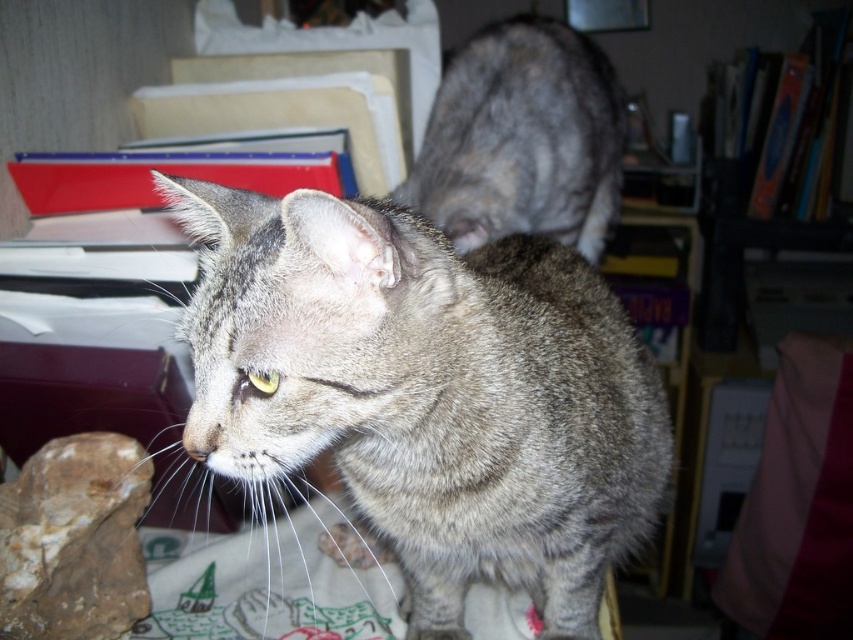
You are an interior designer assessing the placement of items in a home office. You notice the gray tabby cat at center and the brown rough rock at lower left. Which object is positioned higher in the image?

The gray tabby cat at center is located above the brown rough rock at lower left, so the gray tabby cat at center is positioned higher in the image.

You are holding a 12 inch ruler and want to measure the distance from your eyes to the point at the center of the cat. The point is labeled as point (357, 332). Can you determine if the ruler is long enough to measure this distance?

The point (357, 332) and viewer are 29.03 inches apart. Since the ruler is only 12 inches long, it is not long enough to measure the distance from your eyes to the point at the center of the cat.

You are a photographer trying to capture the gray tabby cat at center. The camera you are using has a focus point at coordinate point (x=427, y=392). Will this focus point land on the gray tabby cat at center?

Yes, the point (x=427, y=392) corresponds to the gray tabby cat at center, so the focus point will land on it.